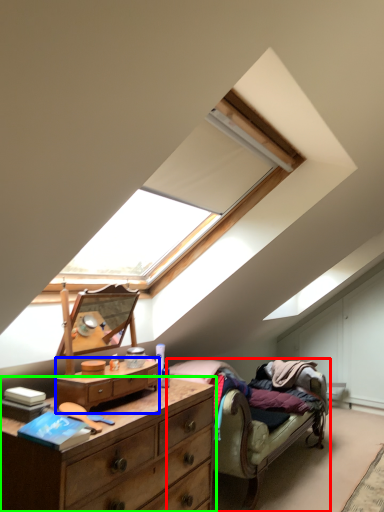
Question: Which object is positioned farthest from studio couch (highlighted by a red box)? Select from chest of drawers (highlighted by a blue box) and chest of drawers (highlighted by a green box).

Choices:
 (A) chest of drawers
 (B) chest of drawers

Answer: (A)